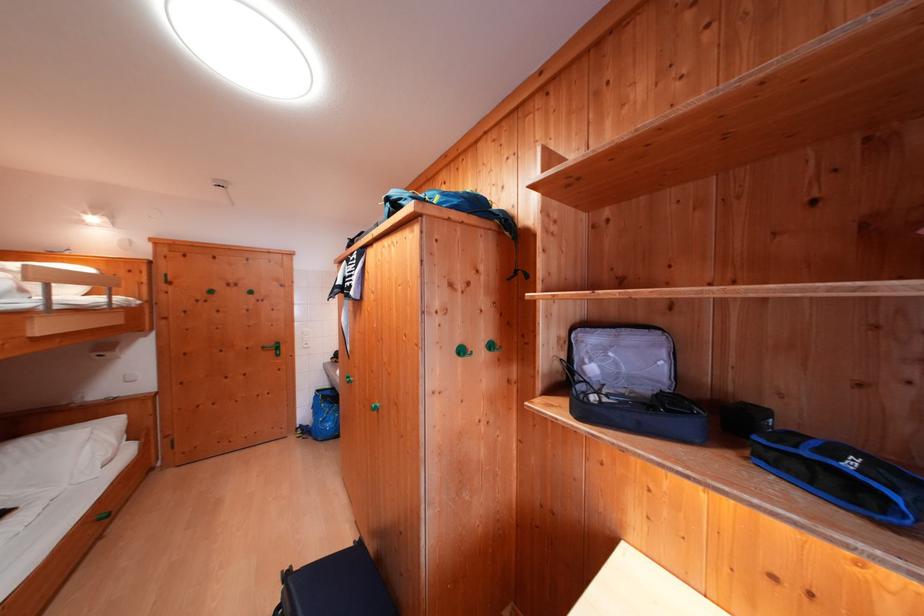
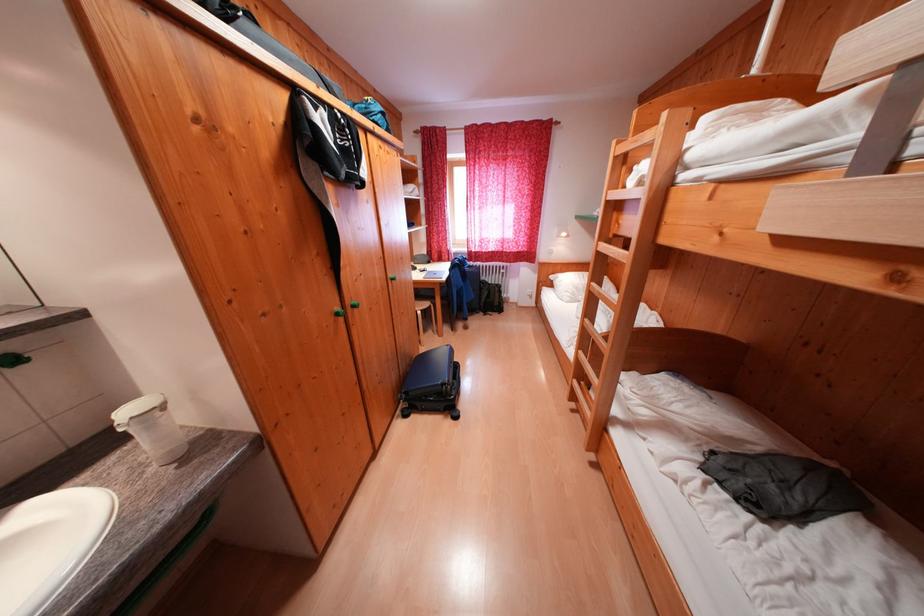
Question: I am providing you with two images of the same scene from different viewpoints. After the viewpoint changes to image2, which objects are now occluded?

Choices:
 (A) green cabinet knob
 (B) chair sitting surface
 (C) green wall hook
 (D) small display box

Answer: (C)